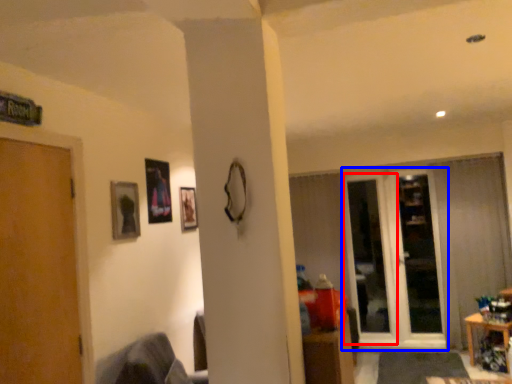
Question: Among these objects, which one is nearest to the camera, screen door (highlighted by a red box) or glass door (highlighted by a blue box)?

Choices:
 (A) screen door
 (B) glass door

Answer: (B)